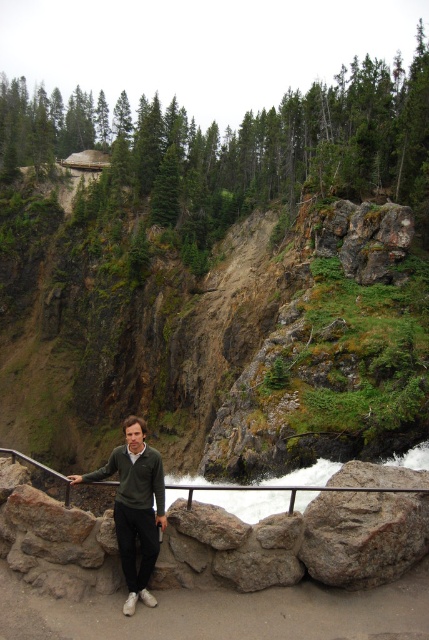
You are a photographer trying to capture the dark green sweater at center and the green mossy rock at upper center in the same frame. Based on their positions, which object would appear larger in the photo?

The green mossy rock at upper center might be wider than the dark green sweater at center, so it could appear larger in the photo depending on their actual sizes and distances from the camera.